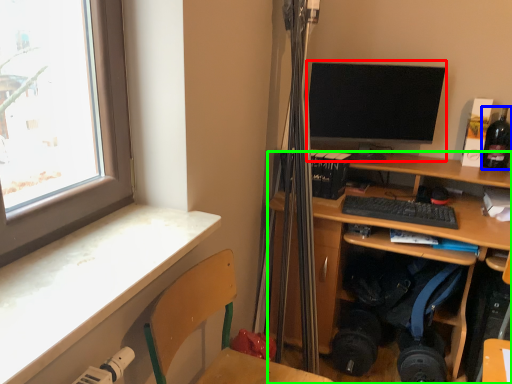
Question: Which object is the farthest from computer monitor (highlighted by a red box)? Choose among these: bottle (highlighted by a blue box) or desk (highlighted by a green box).

Choices:
 (A) bottle
 (B) desk

Answer: (A)